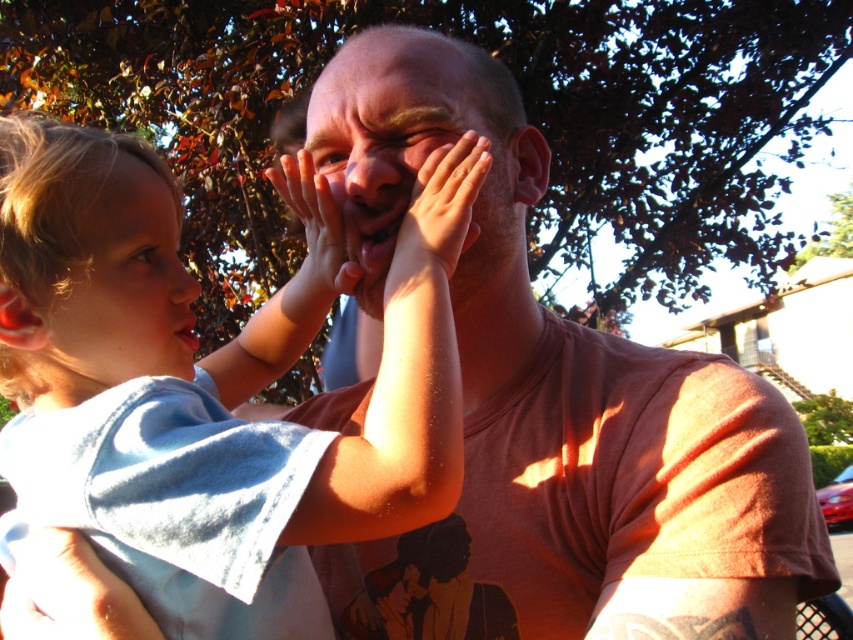
Does matte orange t-shirt at center appear on the left side of smooth skin face at center?

No, matte orange t-shirt at center is not to the left of smooth skin face at center.

The image size is (853, 640). What do you see at coordinates (553, 410) in the screenshot?
I see `matte orange t-shirt at center` at bounding box center [553, 410].

This screenshot has height=640, width=853. Identify the location of matte orange t-shirt at center. (553, 410).

Can you confirm if light blue cotton shirt at left is shorter than smooth skin face at center?

Incorrect, light blue cotton shirt at left's height does not fall short of smooth skin face at center's.

Can you confirm if light blue cotton shirt at left is positioned to the left of smooth skin face at center?

Correct, you'll find light blue cotton shirt at left to the left of smooth skin face at center.

Image resolution: width=853 pixels, height=640 pixels. I want to click on light blue cotton shirt at left, so click(242, 330).

Identify the location of light blue cotton shirt at left. This screenshot has height=640, width=853. (242, 330).

Between point (67, 189) and point (349, 278), which one is positioned behind?

Point (349, 278)

How distant is light blue cotton shirt at left from smooth skin hand at center?

light blue cotton shirt at left and smooth skin hand at center are 6.80 inches apart.

Which is behind, point (173, 252) or point (352, 282)?

The point (352, 282) is more distant.

Locate an element on the screen. The image size is (853, 640). light blue cotton shirt at left is located at coordinates (242, 330).